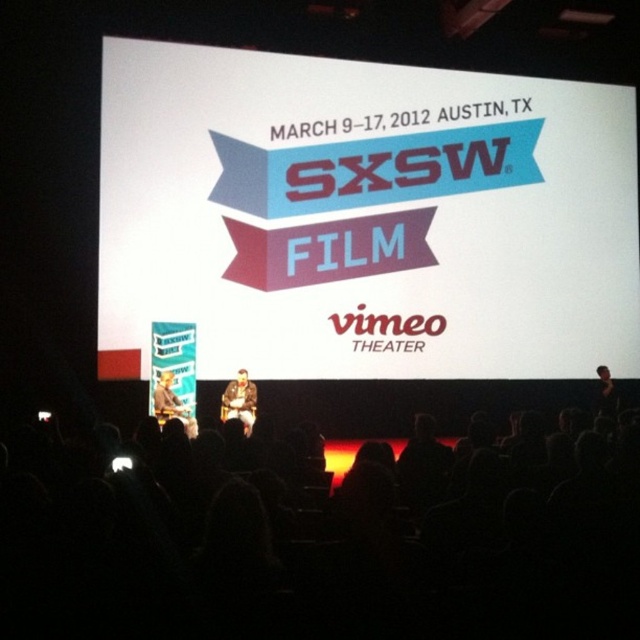
You are an event organizer at the SXSW Film event. You need to place a decorative banner that is 1.5 meters wide between the brown leather jacket at center and the black fabric at right. Based on their widths, will the banner fit between them without overlapping?

The brown leather jacket at center has a larger width than the black fabric at right. Since the banner is 1.5 meters wide, it depends on the combined space between them. However, since the jacket is wider, the total space available might be insufficient. Without exact measurements, it is uncertain if the banner will fit without overlapping.

You are an event coordinator at the SXSW Film event. You need to place a new banner that will be displayed on the stage screen. The banner must be placed to the right of the white paper at center. Where should you position the banner?

The banner should be positioned to the right of the white paper at center, which is currently located at point 0.341 on the x and 0.569 on the y coordinates. Since the banner needs to be to the right, you should adjust the x coordinate to a value greater than 0.341 while keeping the y coordinate around 0.569 to maintain alignment.

You are standing at the entrance of the Vimeo Theater during the SXSW Film event. You see the brown leather jacket at center and the stage with the event branding. How far apart are these two objects?

The brown leather jacket at center and the stage with the event branding are 17.99 meters apart.